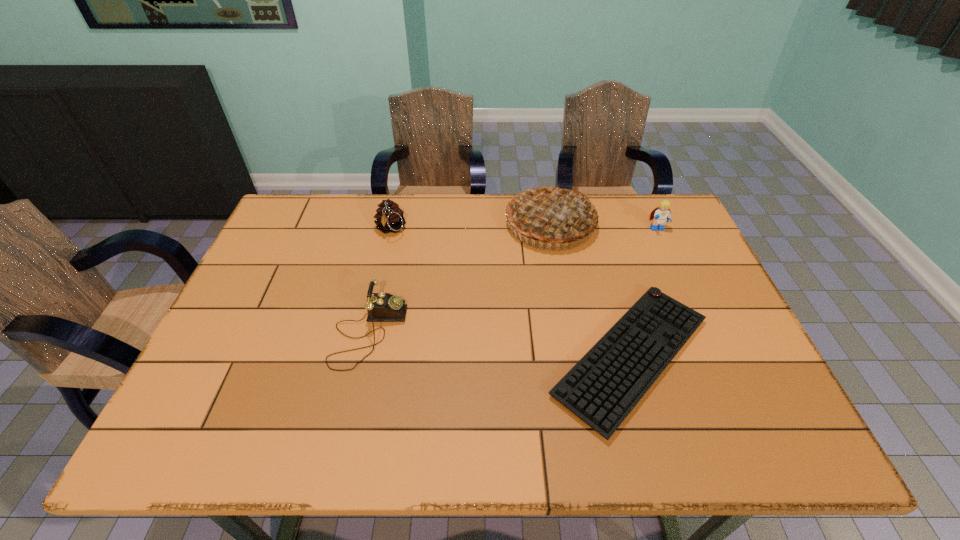
At what (x,y) coordinates should I click in order to perform the action: click on free area in between the pinecone and the tallest object. Please return your answer as a coordinate pair (x, y). The image size is (960, 540). Looking at the image, I should click on (470, 227).

Where is `vacant area that lies between the computer keyboard and the Lego`? Image resolution: width=960 pixels, height=540 pixels. vacant area that lies between the computer keyboard and the Lego is located at coordinates (644, 293).

Locate an element on the screen. the fourth closest object relative to the tallest object is located at coordinates pyautogui.click(x=382, y=307).

The height and width of the screenshot is (540, 960). Find the location of `object identified as the fourth closest to the pinecone`. object identified as the fourth closest to the pinecone is located at coordinates (662, 214).

Find the location of a particular element. Image resolution: width=960 pixels, height=540 pixels. vacant space that satisfies the following two spatial constraints: 1. on the dial of the computer keyboard; 2. on the left side of the telephone is located at coordinates point(364,356).

Where is `free location that satisfies the following two spatial constraints: 1. on the dial of the shortest object; 2. on the right side of the telephone`? This screenshot has width=960, height=540. free location that satisfies the following two spatial constraints: 1. on the dial of the shortest object; 2. on the right side of the telephone is located at coordinates (364, 356).

The height and width of the screenshot is (540, 960). I want to click on free space that satisfies the following two spatial constraints: 1. on the front-facing side of the Lego; 2. on the dial of the telephone, so click(704, 333).

Identify the location of free spot that satisfies the following two spatial constraints: 1. on the dial of the shortest object; 2. on the right side of the telephone. The height and width of the screenshot is (540, 960). (364, 356).

Locate an element on the screen. The width and height of the screenshot is (960, 540). vacant space that satisfies the following two spatial constraints: 1. on the back side of the computer keyboard; 2. on the dial of the telephone is located at coordinates (625, 333).

Image resolution: width=960 pixels, height=540 pixels. I want to click on vacant space that satisfies the following two spatial constraints: 1. on the dial of the computer keyboard; 2. on the left side of the telephone, so click(364, 356).